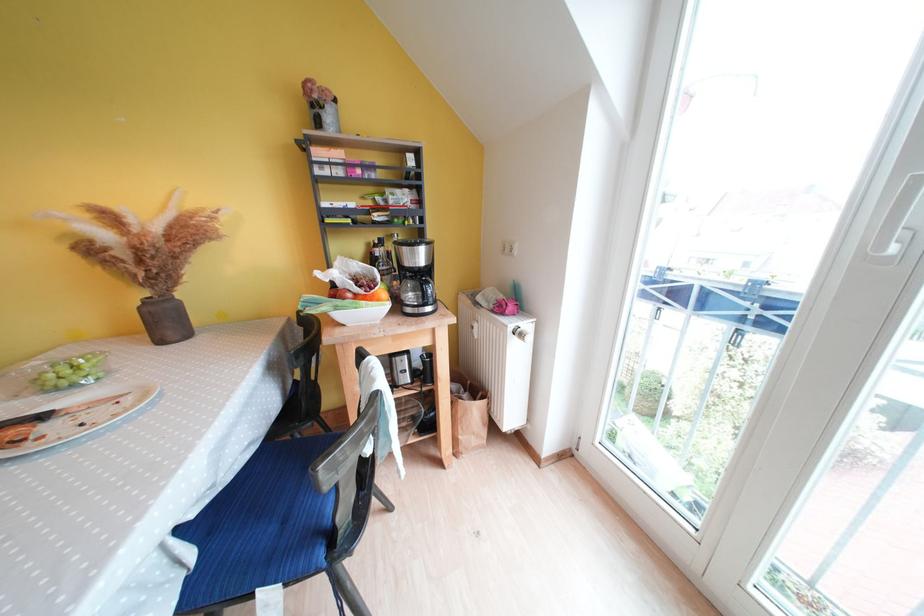
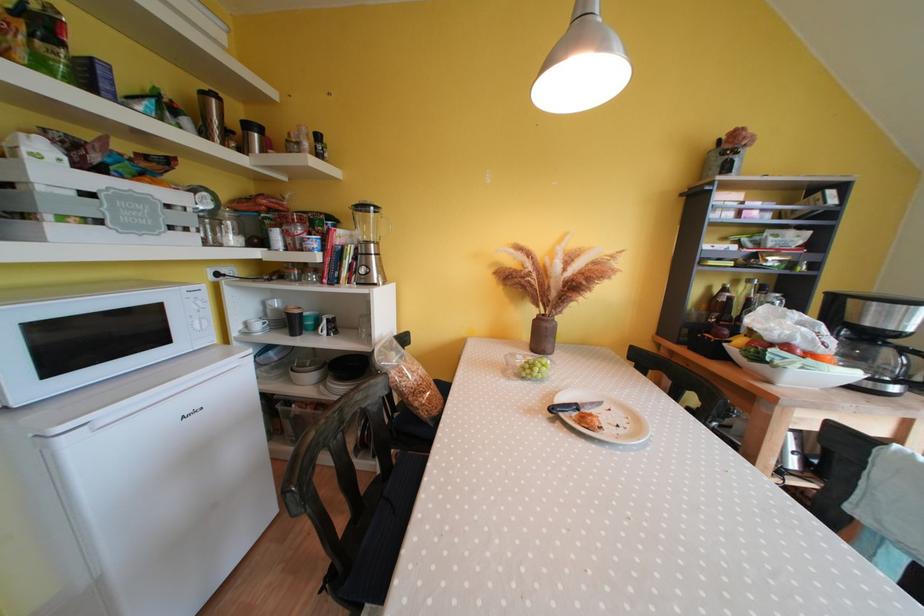
Find the pixel in the second image that matches [89,429] in the first image.

(624, 430)